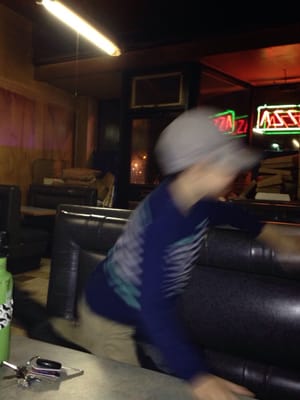
Locate an element on the screen. green bottle is located at coordinates (4, 338).